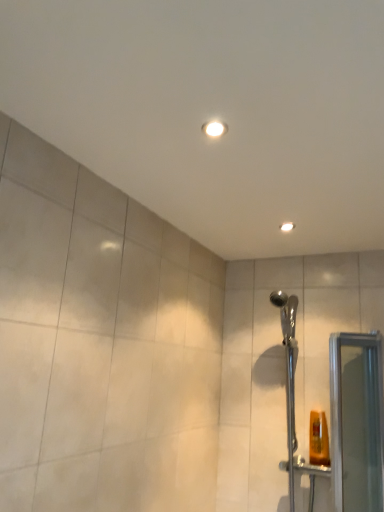
Question: From the image's perspective, does chrome metallic shower head at right appear higher than clear glass screen door at right?

Choices:
 (A) no
 (B) yes

Answer: (B)

Question: Is chrome metallic shower head at right completely or partially outside of clear glass screen door at right?

Choices:
 (A) no
 (B) yes

Answer: (B)

Question: From the image's perspective, is chrome metallic shower head at right under clear glass screen door at right?

Choices:
 (A) no
 (B) yes

Answer: (A)

Question: Could you tell me if chrome metallic shower head at right is facing clear glass screen door at right?

Choices:
 (A) no
 (B) yes

Answer: (A)

Question: Does chrome metallic shower head at right have a greater width compared to clear glass screen door at right?

Choices:
 (A) yes
 (B) no

Answer: (A)

Question: Based on their sizes in the image, would you say matte white light fixture at upper center is bigger or smaller than chrome metallic shower head at right?

Choices:
 (A) small
 (B) big

Answer: (A)

Question: Considering the relative positions of matte white light fixture at upper center and chrome metallic shower head at right in the image provided, is matte white light fixture at upper center to the left or to the right of chrome metallic shower head at right?

Choices:
 (A) right
 (B) left

Answer: (B)

Question: From a real-world perspective, is matte white light fixture at upper center positioned above or below chrome metallic shower head at right?

Choices:
 (A) above
 (B) below

Answer: (A)

Question: Is matte white light fixture at upper center taller or shorter than chrome metallic shower head at right?

Choices:
 (A) tall
 (B) short

Answer: (B)

Question: In terms of height, does matte white light fixture at upper center look taller or shorter compared to clear glass screen door at right?

Choices:
 (A) short
 (B) tall

Answer: (A)

Question: Considering the positions of point (279, 225) and point (336, 348), is point (279, 225) closer or farther from the camera than point (336, 348)?

Choices:
 (A) closer
 (B) farther

Answer: (A)

Question: Relative to clear glass screen door at right, is matte white light fixture at upper center in front or behind?

Choices:
 (A) front
 (B) behind

Answer: (B)

Question: Which is correct: matte white light fixture at upper center is inside clear glass screen door at right, or outside of it?

Choices:
 (A) outside
 (B) inside

Answer: (A)

Question: Is clear glass screen door at right spatially inside chrome metallic shower head at right, or outside of it?

Choices:
 (A) inside
 (B) outside

Answer: (B)

Question: Is clear glass screen door at right wider or thinner than chrome metallic shower head at right?

Choices:
 (A) thin
 (B) wide

Answer: (A)